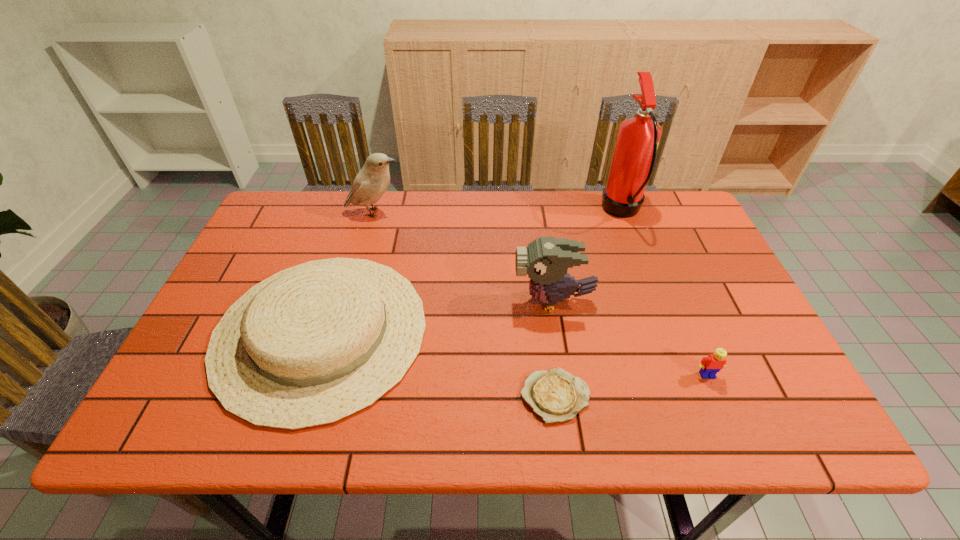
Find the location of `object located in the left edge section of the desktop`. object located in the left edge section of the desktop is located at coordinates (313, 344).

Where is `fire extinguisher at the right edge`? This screenshot has height=540, width=960. fire extinguisher at the right edge is located at coordinates (634, 156).

The width and height of the screenshot is (960, 540). Identify the location of Lego at the right edge. (710, 365).

You are a GUI agent. You are given a task and a screenshot of the screen. Output one action in this format:
    pyautogui.click(x=<x>, y=<y>)
    Task: Click on the object that is at the near left corner
    
    Given the screenshot: What is the action you would take?
    pyautogui.click(x=313, y=344)

In order to click on object that is at the far right corner in this screenshot , I will do `click(634, 156)`.

Locate an element on the screen. vacant space at the far edge is located at coordinates (422, 193).

The width and height of the screenshot is (960, 540). Identify the location of vacant space at the near edge. (277, 437).

This screenshot has height=540, width=960. Find the location of `vacant space at the left edge of the desktop`. vacant space at the left edge of the desktop is located at coordinates (202, 343).

This screenshot has height=540, width=960. I want to click on free point at the right edge, so click(661, 251).

This screenshot has height=540, width=960. In order to click on vacant space at the far right corner of the desktop in this screenshot , I will do `click(694, 238)`.